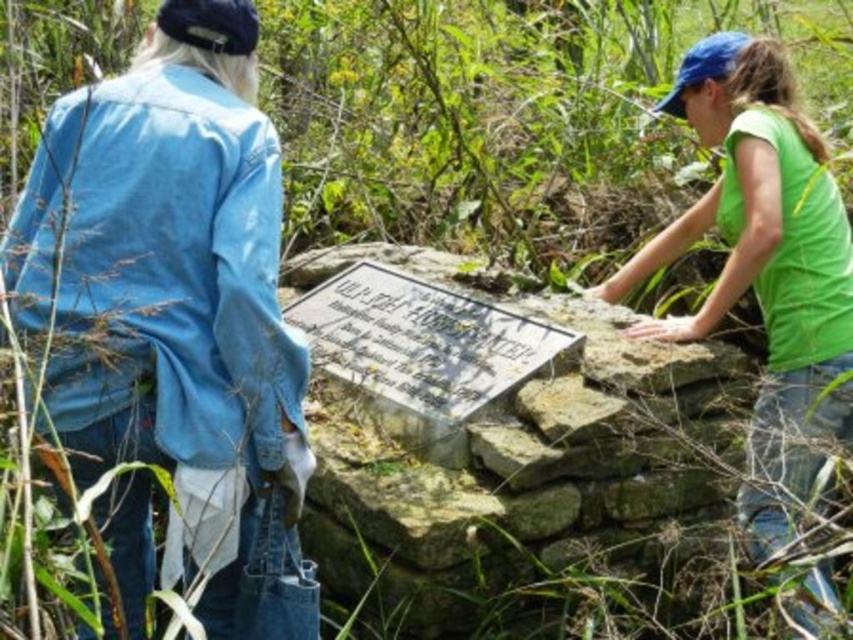
Is denim jacket at upper left to the right of green matte shirt at upper right from the viewer's perspective?

In fact, denim jacket at upper left is to the left of green matte shirt at upper right.

Between point (39, 147) and point (718, 68), which one is positioned in front?

Point (39, 147) is more forward.

Locate an element on the screen. denim jacket at upper left is located at coordinates (177, 308).

Is green matte shirt at upper right below metallic silver plaque at center?

Incorrect, green matte shirt at upper right is not positioned below metallic silver plaque at center.

In order to click on green matte shirt at upper right in this screenshot , I will do `click(763, 244)`.

Locate an element on the screen. denim jacket at upper left is located at coordinates tap(177, 308).

Is point (78, 140) farther from viewer compared to point (363, 324)?

No.

Who is more forward, (44,134) or (352,285)?

Point (44,134) is in front.

Locate an element on the screen. denim jacket at upper left is located at coordinates (177, 308).